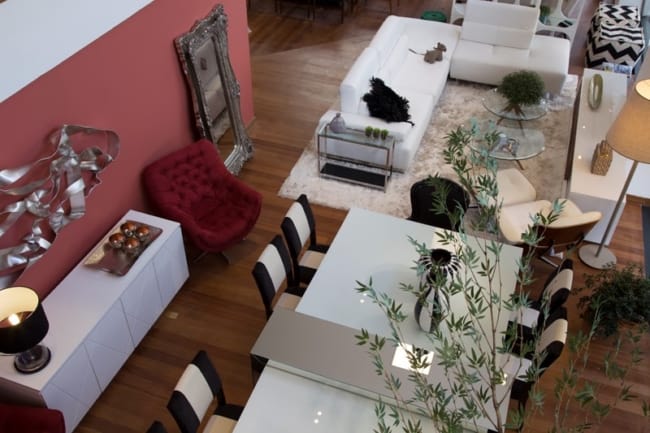
You are a GUI agent. You are given a task and a screenshot of the screen. Output one action in this format:
    pyautogui.click(x=<x>, y=<y>)
    Task: Click on the white brown chairs
    This screenshot has height=433, width=650.
    Given the screenshot: What is the action you would take?
    pyautogui.click(x=273, y=269), pyautogui.click(x=305, y=232), pyautogui.click(x=569, y=300), pyautogui.click(x=562, y=343), pyautogui.click(x=203, y=400)